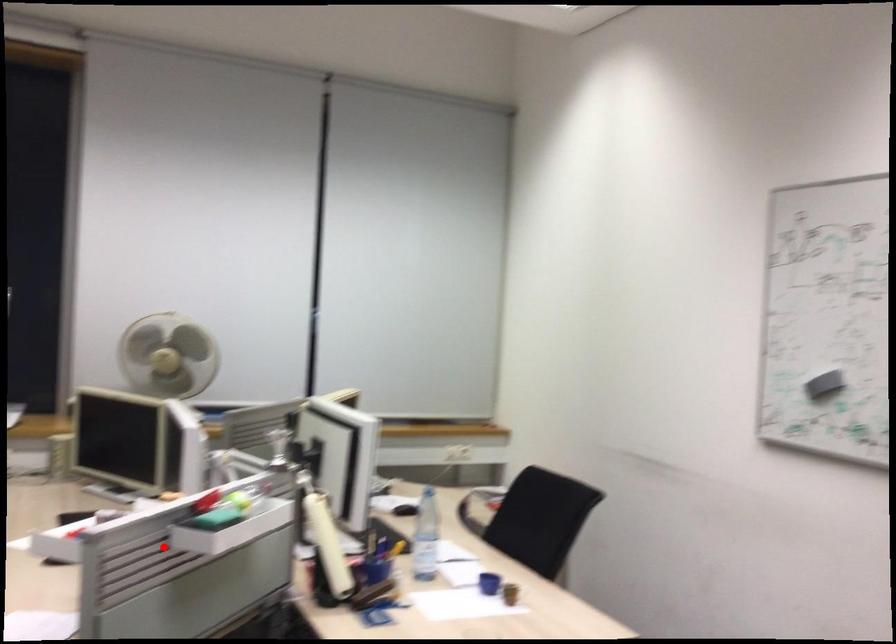
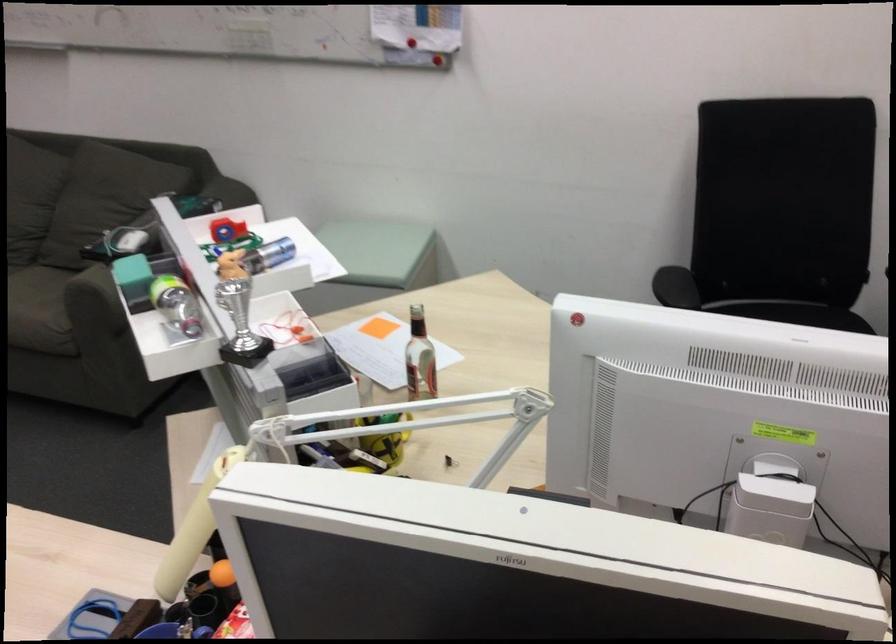
Question: I am providing you with two images of the same scene from different viewpoints. In image1, a red point is highlighted. Considering the same 3D point in image2, which of the following is correct?

Choices:
 (A) It is closer
 (B) It is farther

Answer: (A)